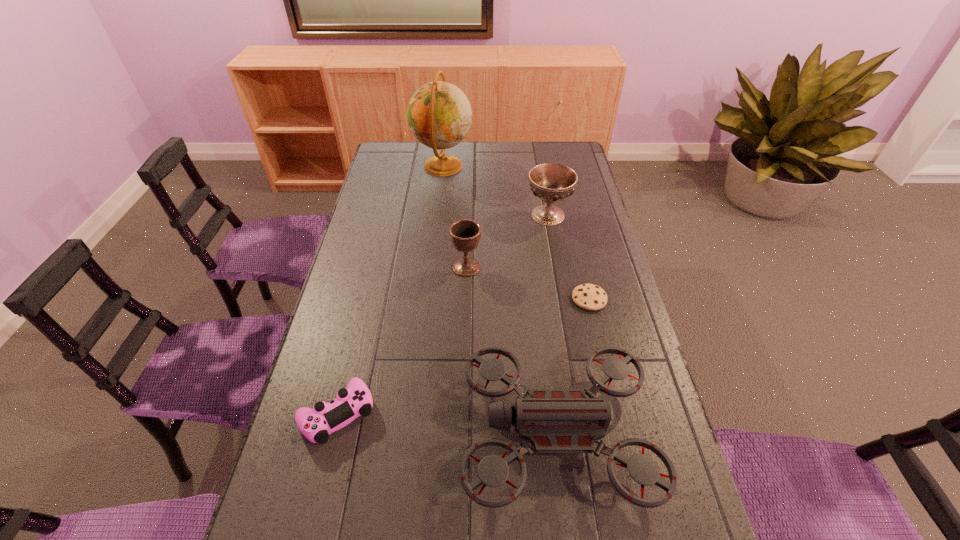
This screenshot has width=960, height=540. What are the coordinates of `the farthest object` in the screenshot? It's located at (439, 114).

You are a GUI agent. You are given a task and a screenshot of the screen. Output one action in this format:
    pyautogui.click(x=<x>, y=<y>)
    Task: Click on the tallest object
    The width and height of the screenshot is (960, 540).
    Given the screenshot: What is the action you would take?
    pyautogui.click(x=439, y=114)

I want to click on the second farthest object, so click(x=551, y=182).

You are a GUI agent. You are given a task and a screenshot of the screen. Output one action in this format:
    pyautogui.click(x=<x>, y=<y>)
    Task: Click on the farther chalice
    
    Given the screenshot: What is the action you would take?
    pyautogui.click(x=551, y=182)

You are a GUI agent. You are given a task and a screenshot of the screen. Output one action in this format:
    pyautogui.click(x=<x>, y=<y>)
    Task: Click on the third farthest object
    The width and height of the screenshot is (960, 540).
    Given the screenshot: What is the action you would take?
    pyautogui.click(x=465, y=234)

You are a GUI agent. You are given a task and a screenshot of the screen. Output one action in this format:
    pyautogui.click(x=<x>, y=<y>)
    Task: Click on the nearer chalice
    Image resolution: width=960 pixels, height=540 pixels.
    Given the screenshot: What is the action you would take?
    pyautogui.click(x=465, y=234)

Where is `the fourth tallest object`? Image resolution: width=960 pixels, height=540 pixels. the fourth tallest object is located at coordinates (553, 420).

Locate an element on the screen. control is located at coordinates (316, 424).

The image size is (960, 540). What are the coordinates of `the third nearest object` in the screenshot? It's located at (587, 296).

This screenshot has height=540, width=960. Identify the location of the shortest object. (587, 296).